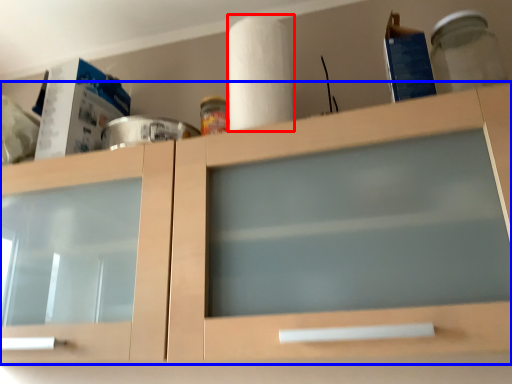
Question: Which object appears farthest to the camera in this image, paper towel (highlighted by a red box) or cabinetry (highlighted by a blue box)?

Choices:
 (A) paper towel
 (B) cabinetry

Answer: (A)